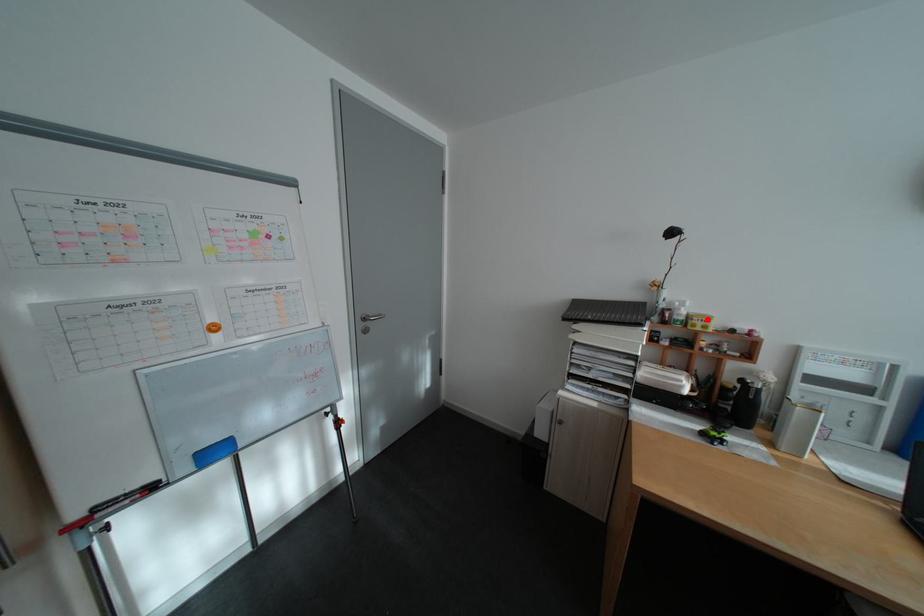
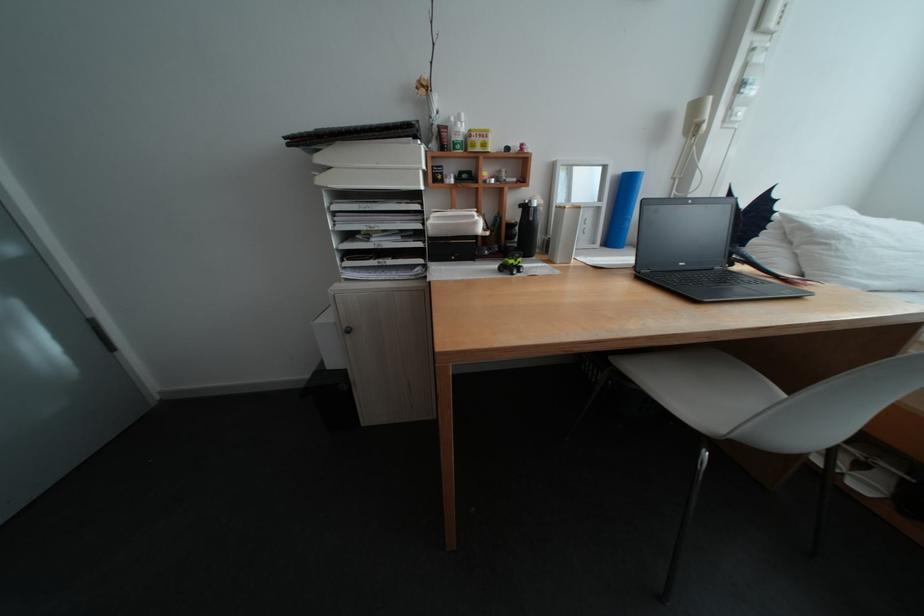
Question: I am providing you with two images of the same scene from different viewpoints. A red point is marked on the first image. Can you still see the location of the red point in image 2?

Choices:
 (A) Yes
 (B) No

Answer: (A)